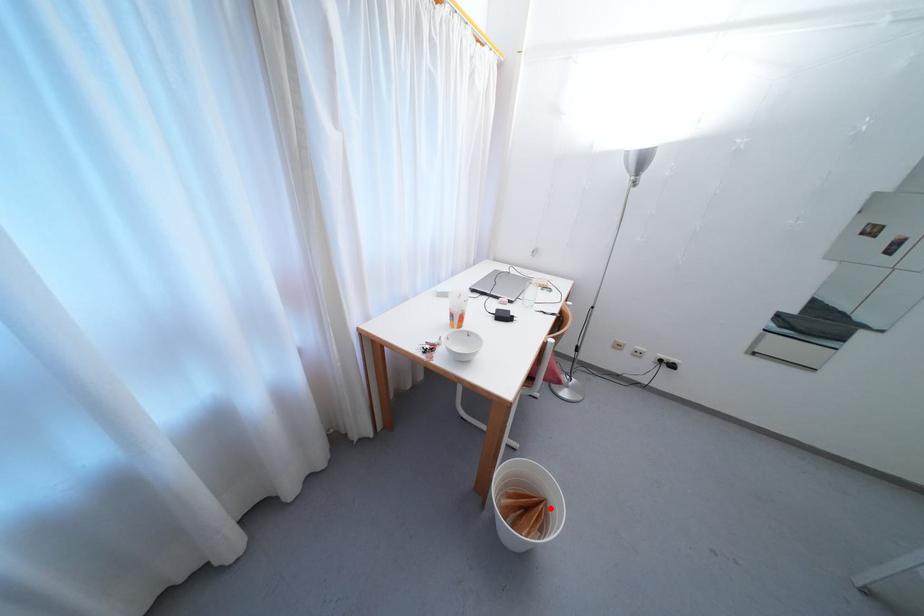
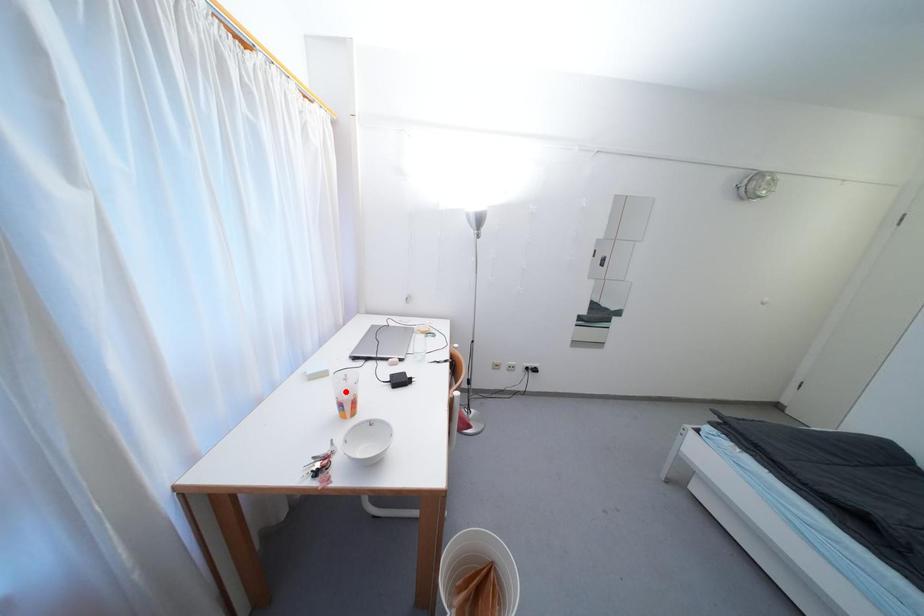
I am providing you with two images of the same scene from different viewpoints. A red point is marked on the first image and another point is marked on the second image. Does the point marked in image1 correspond to the same location as the one in image2?

No